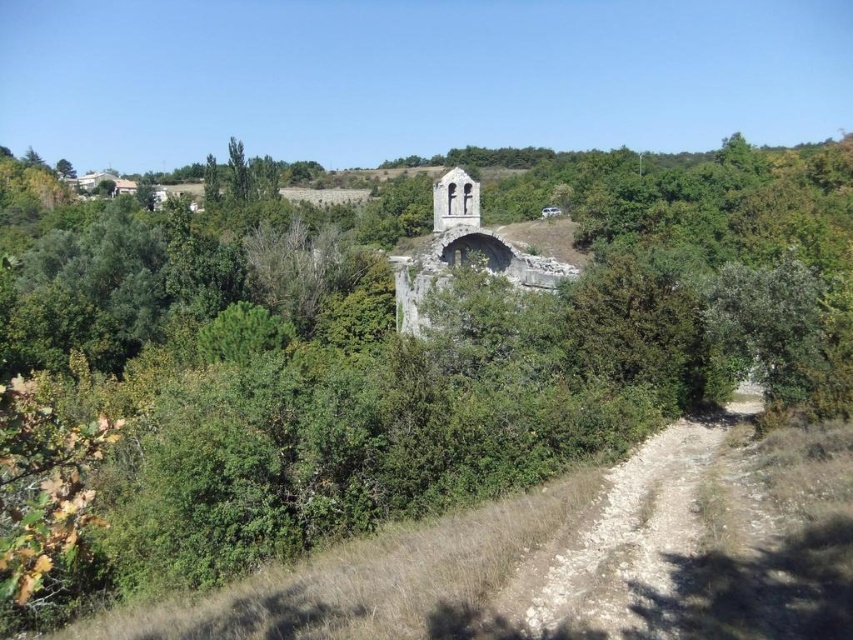
Does dirt/gravel path at lower right appear under stone tower at center?

Yes, dirt/gravel path at lower right is below stone tower at center.

From the picture: Is dirt/gravel path at lower right positioned at the back of stone tower at center?

No, dirt/gravel path at lower right is in front of stone tower at center.

At what (x,y) coordinates should I click in order to perform the action: click on dirt/gravel path at lower right. Please return your answer as a coordinate pair (x, y). Looking at the image, I should click on pos(622,538).